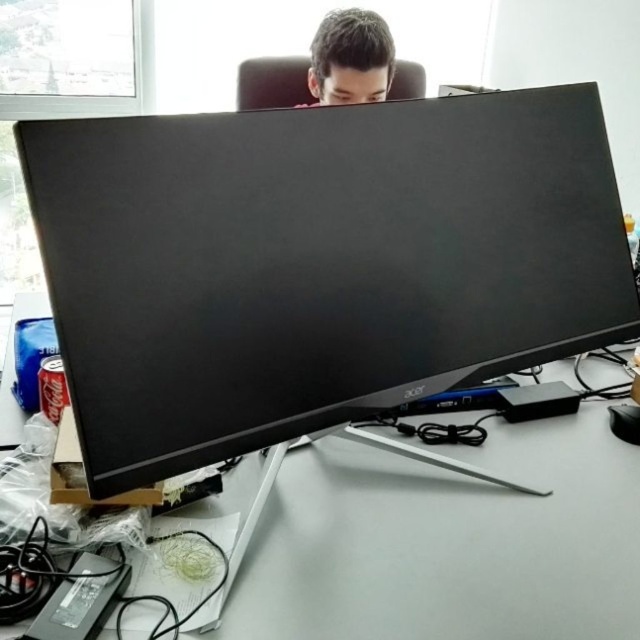
Question: Can you confirm if black matte monitor at center is positioned above brown matte hair at upper center?

Choices:
 (A) no
 (B) yes

Answer: (A)

Question: Among these objects, which one is nearest to the camera?

Choices:
 (A) white plastic computer desk at center
 (B) brown matte hair at upper center
 (C) black matte monitor at center

Answer: (C)

Question: Which point appears farthest from the camera in this image?

Choices:
 (A) (237, 476)
 (B) (324, 205)

Answer: (A)

Question: Can you confirm if black matte monitor at center is wider than brown matte hair at upper center?

Choices:
 (A) yes
 (B) no

Answer: (A)

Question: Does black matte monitor at center appear on the left side of brown matte hair at upper center?

Choices:
 (A) yes
 (B) no

Answer: (B)

Question: Estimate the real-world distances between objects in this image. Which object is closer to the brown matte hair at upper center?

Choices:
 (A) black matte monitor at center
 (B) white plastic computer desk at center

Answer: (A)